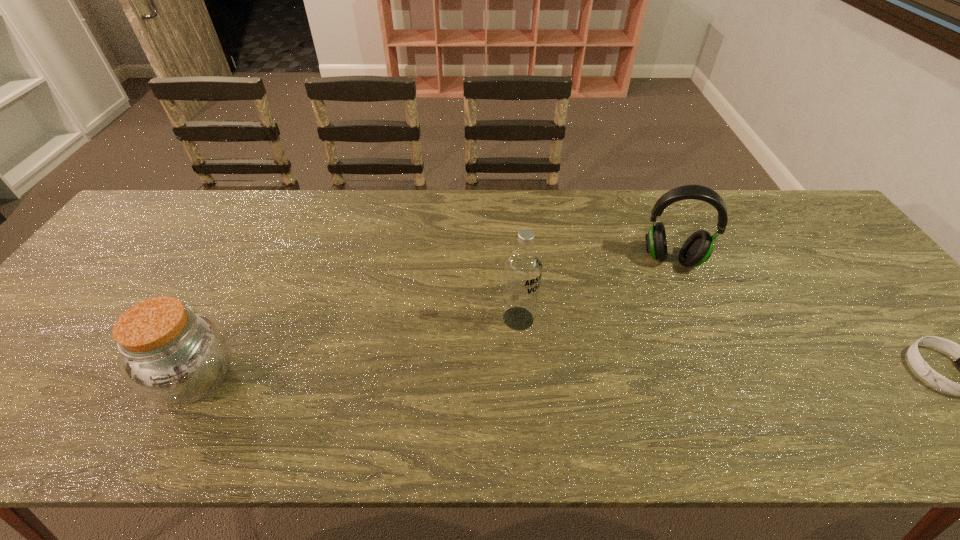
Where is `the leftmost object`? the leftmost object is located at coordinates (169, 353).

Locate an element on the screen. The width and height of the screenshot is (960, 540). vodka is located at coordinates (523, 267).

Locate an element on the screen. Image resolution: width=960 pixels, height=540 pixels. the second farthest object is located at coordinates (523, 267).

This screenshot has width=960, height=540. In order to click on the third object from left to right in this screenshot , I will do `click(697, 249)`.

You are a GUI agent. You are given a task and a screenshot of the screen. Output one action in this format:
    pyautogui.click(x=<x>, y=<y>)
    Task: Click on the headset
    Image resolution: width=960 pixels, height=540 pixels.
    Given the screenshot: What is the action you would take?
    pyautogui.click(x=697, y=249)

You are a GUI agent. You are given a task and a screenshot of the screen. Output one action in this format:
    pyautogui.click(x=<x>, y=<y>)
    Task: Click on the free space located 0.150m on the back of the leftmost object
    Image resolution: width=960 pixels, height=540 pixels.
    Given the screenshot: What is the action you would take?
    pyautogui.click(x=239, y=295)

Where is `free space located 0.190m on the front label of the third nearest object`? Image resolution: width=960 pixels, height=540 pixels. free space located 0.190m on the front label of the third nearest object is located at coordinates (590, 381).

You are a GUI agent. You are given a task and a screenshot of the screen. Output one action in this format:
    pyautogui.click(x=<x>, y=<y>)
    Task: Click on the free spot located on the front label of the third nearest object
    Image resolution: width=960 pixels, height=540 pixels.
    Given the screenshot: What is the action you would take?
    pyautogui.click(x=612, y=400)

What are the coordinates of `vacant area situated on the front label of the third nearest object` in the screenshot? It's located at (545, 342).

The width and height of the screenshot is (960, 540). Identify the location of free spot located on the ear cups of the headset. (667, 348).